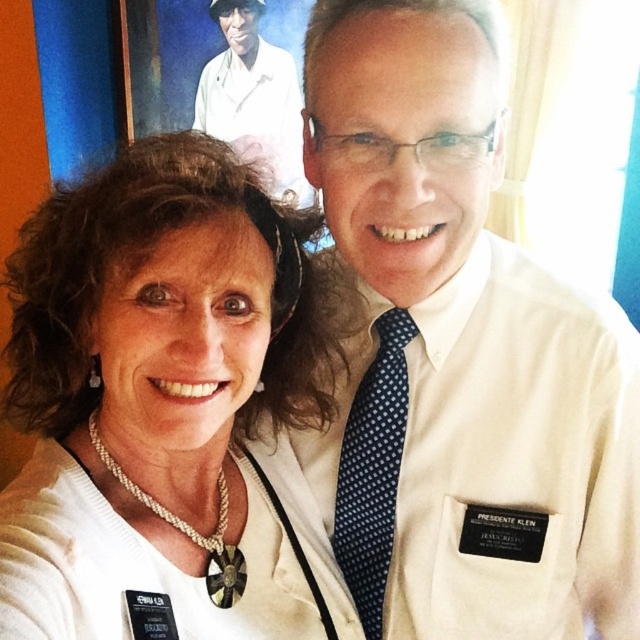
Is pearl necklace at center bigger than white smooth shirt at upper center?

Indeed, pearl necklace at center has a larger size compared to white smooth shirt at upper center.

Can you confirm if pearl necklace at center is shorter than white smooth shirt at upper center?

Correct, pearl necklace at center is not as tall as white smooth shirt at upper center.

Find the location of a particular element. The height and width of the screenshot is (640, 640). pearl necklace at center is located at coordinates (168, 406).

Which is more to the left, blue dotted tie at center or white smooth shirt at upper center?

From the viewer's perspective, white smooth shirt at upper center appears more on the left side.

Between blue dotted tie at center and white smooth shirt at upper center, which one has more height?

Standing taller between the two is white smooth shirt at upper center.

Between point (390, 444) and point (250, 154), which one is positioned in front?

Positioned in front is point (390, 444).

At what (x,y) coordinates should I click in order to perform the action: click on blue dotted tie at center. Please return your answer as a coordinate pair (x, y). This screenshot has height=640, width=640. Looking at the image, I should click on (372, 470).

Can you confirm if pearl necklace at center is smaller than blue dotted tie at center?

No.

Between point (236, 634) and point (378, 422), which one is positioned in front?

Positioned in front is point (236, 634).

The height and width of the screenshot is (640, 640). What do you see at coordinates (168, 406) in the screenshot? I see `pearl necklace at center` at bounding box center [168, 406].

Locate an element on the screen. The image size is (640, 640). pearl necklace at center is located at coordinates (168, 406).